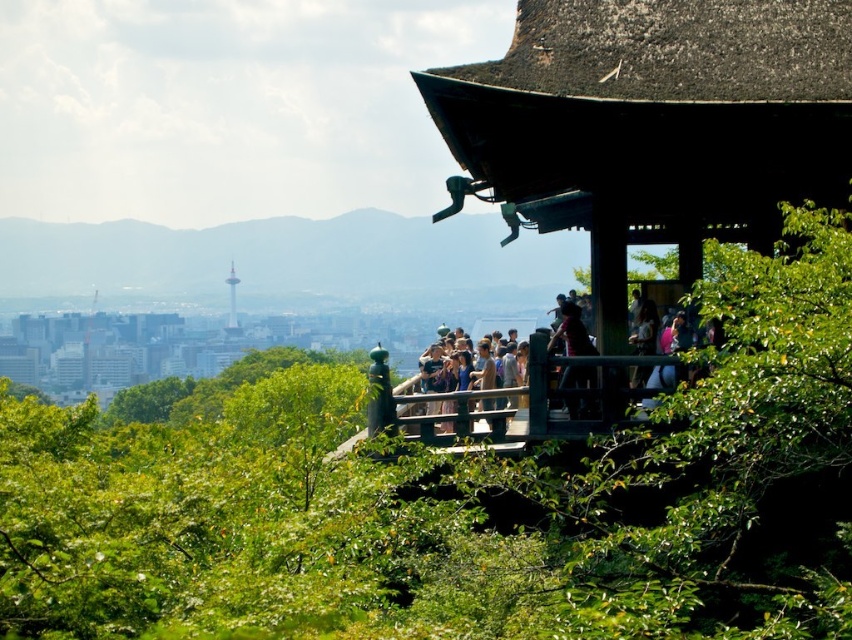
You are standing at the wooden railing in front of the pavilion. You want to take a photo of the multicolored casual clothing at center while also including the green leafy mountain at upper left in the frame. Which direction should you adjust your camera to ensure both are in the shot?

Since the green leafy mountain at upper left is to the left of the multicolored casual clothing at center, you should position your camera to the right side to include both the multicolored casual clothing at center and the green leafy mountain at upper left in the frame.

You are standing at the entrance of the pavilion and want to take a photo of the green leafy trees at center. According to the coordinates provided, where should you aim your camera?

The green leafy trees at center are located at coordinates point (461, 496), so aim your camera towards that point to capture them.

You are standing at the wooden railing in the scene. Looking towards the green leafy trees at center and the green leafy mountain at upper left, which one is positioned higher in the image?

The green leafy mountain at upper left is positioned higher in the image than the green leafy trees at center.